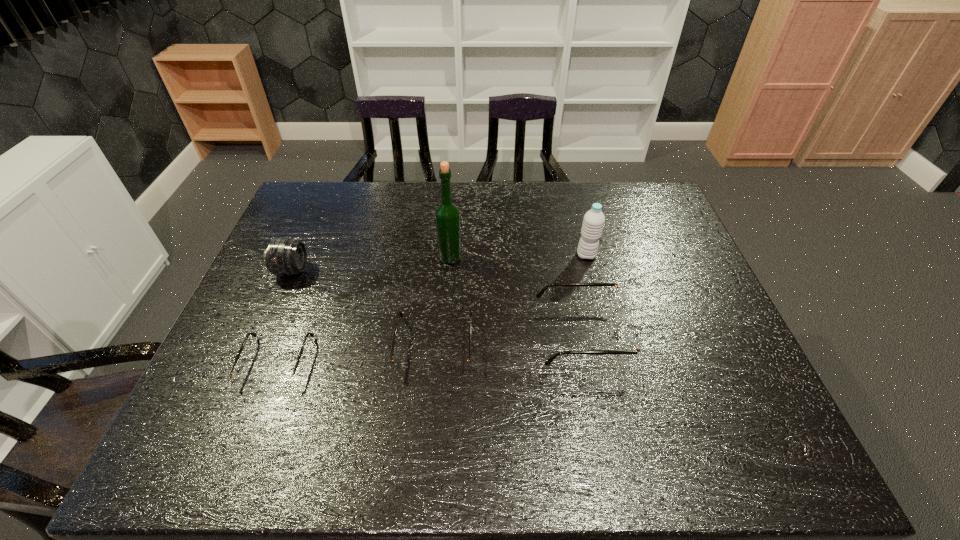
I want to click on vacant space at the right edge, so click(x=703, y=310).

What are the coordinates of `vacant space at the far left corner of the desktop` in the screenshot? It's located at [x=331, y=182].

In the image, there is a desktop. At what (x,y) coordinates should I click in order to perform the action: click on free space at the near right corner. Please return your answer as a coordinate pair (x, y). Looking at the image, I should click on (720, 415).

The image size is (960, 540). What are the coordinates of `free space between the tallest object and the rightmost spectacles` in the screenshot? It's located at (516, 295).

The image size is (960, 540). Identify the location of free space between the telephoto lens and the water bottle. (439, 263).

Where is `free space between the third tallest object and the second tallest object`? free space between the third tallest object and the second tallest object is located at coordinates (439, 263).

I want to click on empty location between the telephoto lens and the second tallest object, so point(439,263).

At what (x,y) coordinates should I click in order to perform the action: click on empty space that is in between the tallest object and the second shortest object. Please return your answer as a coordinate pair (x, y). The height and width of the screenshot is (540, 960). Looking at the image, I should click on (443, 302).

I want to click on free space between the telephoto lens and the second spectacles from right to left, so click(363, 309).

Image resolution: width=960 pixels, height=540 pixels. Find the location of `free space between the liquor and the leftmost spectacles`. free space between the liquor and the leftmost spectacles is located at coordinates (363, 310).